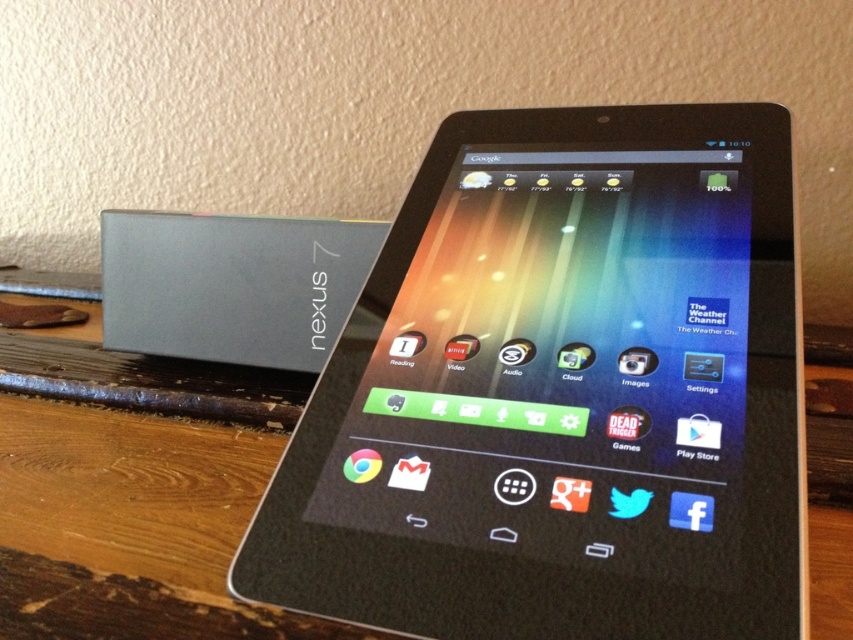
Question: Among these points, which one is farthest from the camera?

Choices:
 (A) (431, 394)
 (B) (323, 275)

Answer: (B)

Question: Is black glossy tablet at center bigger than slate gray plastic nexus 7 at left?

Choices:
 (A) yes
 (B) no

Answer: (A)

Question: Which object appears closest to the camera in this image?

Choices:
 (A) black glossy tablet at center
 (B) slate gray plastic nexus 7 at left

Answer: (A)

Question: Which object is farther from the camera taking this photo?

Choices:
 (A) black glossy tablet at center
 (B) slate gray plastic nexus 7 at left

Answer: (B)

Question: Does black glossy tablet at center have a lesser width compared to slate gray plastic nexus 7 at left?

Choices:
 (A) no
 (B) yes

Answer: (A)

Question: Is black glossy tablet at center bigger than slate gray plastic nexus 7 at left?

Choices:
 (A) no
 (B) yes

Answer: (B)